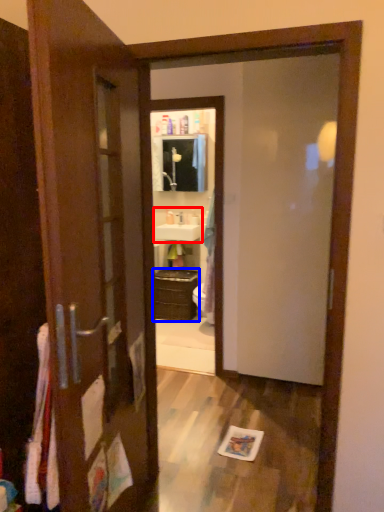
Question: Which object appears closest to the camera in this image, sink (highlighted by a red box) or cabinetry (highlighted by a blue box)?

Choices:
 (A) sink
 (B) cabinetry

Answer: (B)